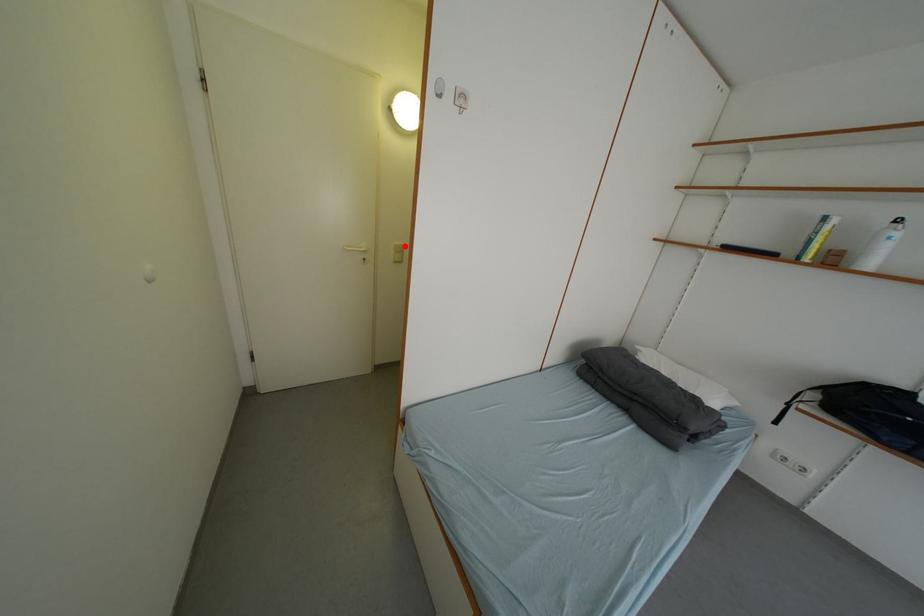
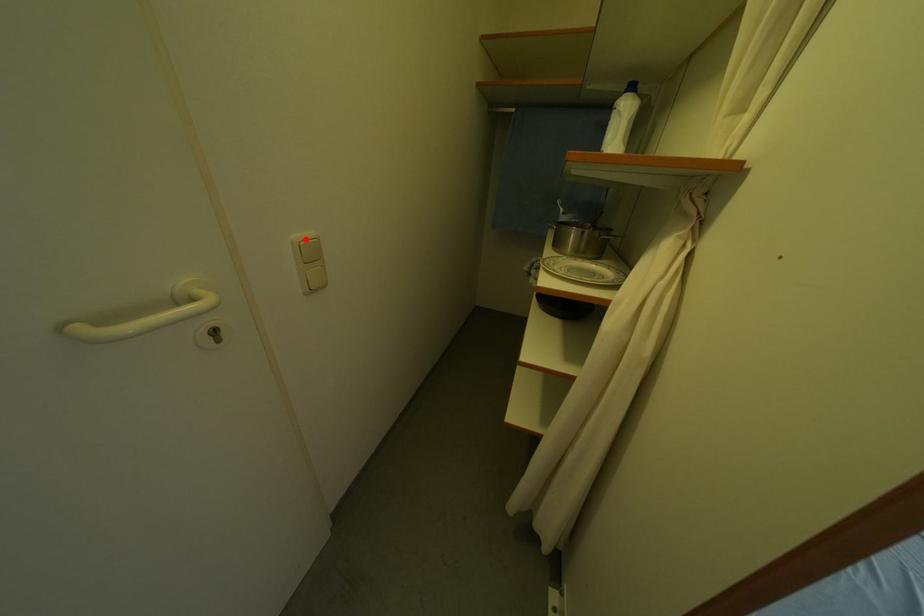
I am providing you with two images of the same scene from different viewpoints. A red point is marked on the first image and another point is marked on the second image. Is the red point in image1 aligned with the point shown in image2?

Yes